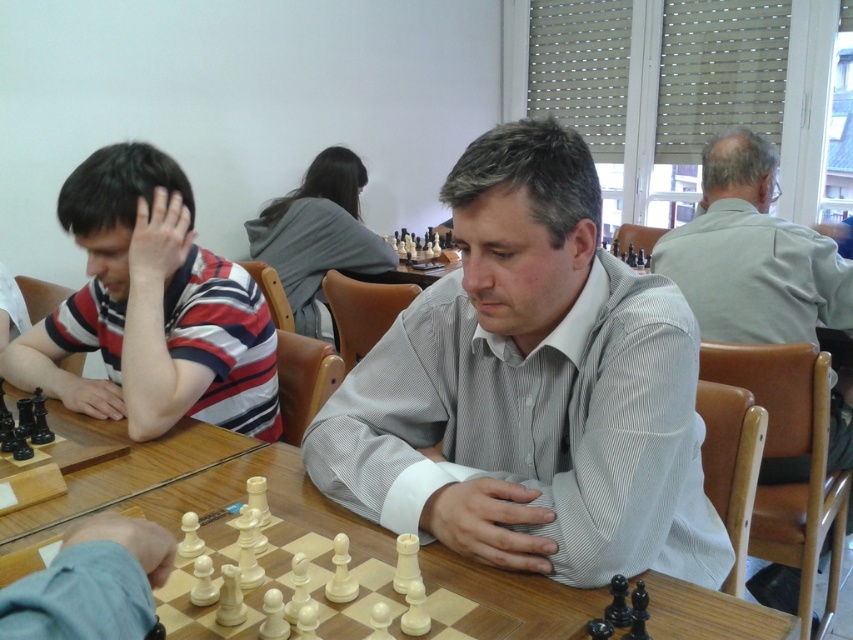
Can you confirm if striped cotton shirt at left is wider than wooden at center?

No.

Who is more distant from viewer, (90, 312) or (442, 584)?

Point (90, 312)

Identify the location of striped cotton shirt at left. The image size is (853, 640). (151, 308).

Is point (485, 269) in front of point (79, 182)?

Yes, point (485, 269) is closer to viewer.

Between light gray striped shirt at center and striped cotton shirt at left, which one appears on the right side from the viewer's perspective?

From the viewer's perspective, light gray striped shirt at center appears more on the right side.

Is point (486, 342) less distant than point (140, 401)?

That is True.

You are a GUI agent. You are given a task and a screenshot of the screen. Output one action in this format:
    pyautogui.click(x=<x>, y=<y>)
    Task: Click on the light gray striped shirt at center
    Image resolution: width=853 pixels, height=640 pixels.
    Given the screenshot: What is the action you would take?
    pos(531,388)

Is point (776, 161) farther from viewer compared to point (718, 616)?

Yes, point (776, 161) is farther from viewer.

Image resolution: width=853 pixels, height=640 pixels. Find the location of `light gray shirt at upper right`. light gray shirt at upper right is located at coordinates coord(752,253).

Find the location of a particular element. light gray shirt at upper right is located at coordinates (752, 253).

This screenshot has height=640, width=853. I want to click on light gray shirt at upper right, so click(752, 253).